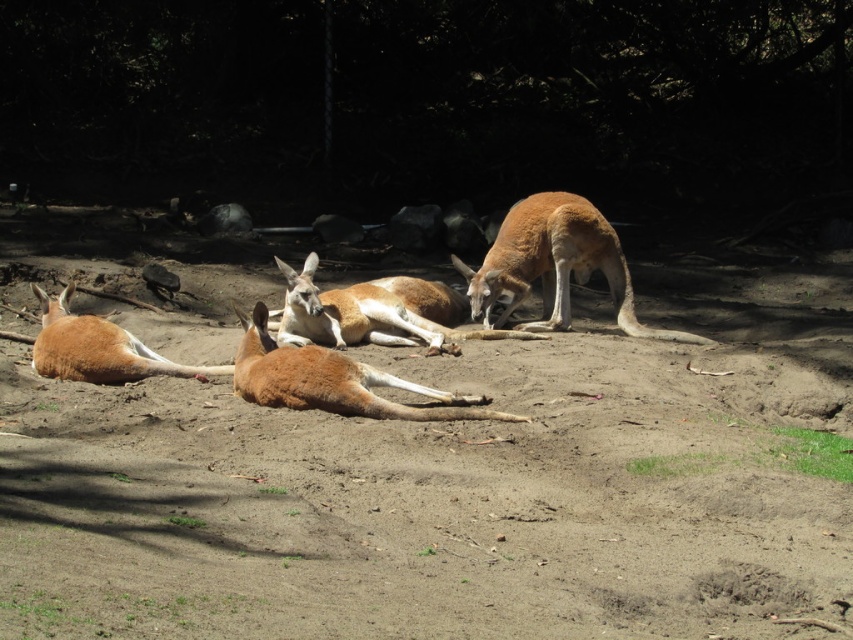
You are a photographer trying to capture a closeup of the kangaroos. You notice two points in the scene marked as point 1 at coordinates point (299,323) and point 2 at coordinates point (78,358). Which point is closer to your camera lens?

Point (299,323) is further to the viewer than point (78,358), so the point closer to the camera lens is point (78,358).

You are a wildlife photographer aiming to capture a closeup of the brown fur kangaroo at center. Your camera is currently focused on the point at coordinates point (363, 316). Is this point likely to be on the brown fur kangaroo at center?

Yes, the point (363, 316) indicates the brown fur kangaroo at center, so the camera is focused on the correct subject.